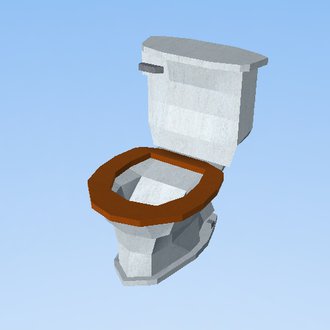
The height and width of the screenshot is (330, 330). In order to click on use to flush toilet in this screenshot , I will do `click(145, 67)`.